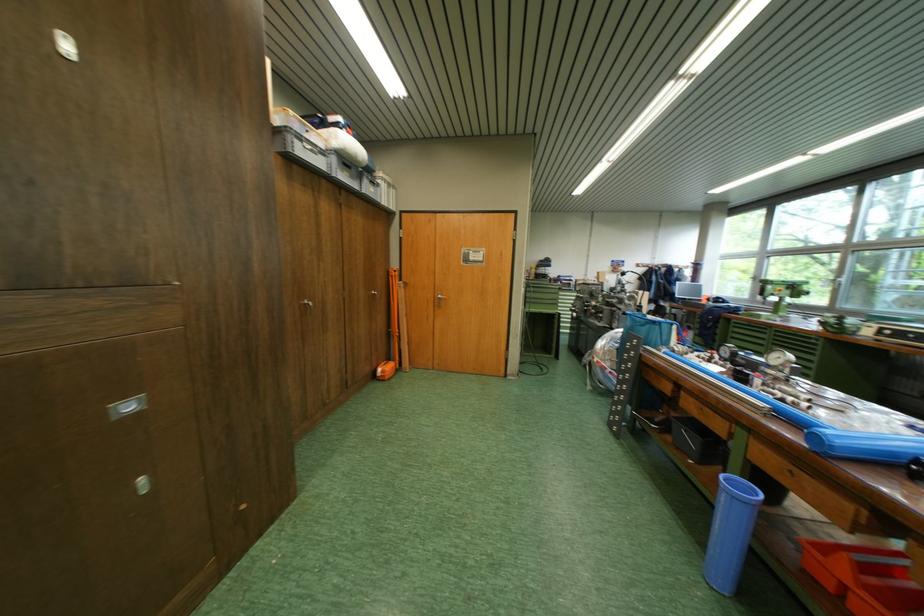
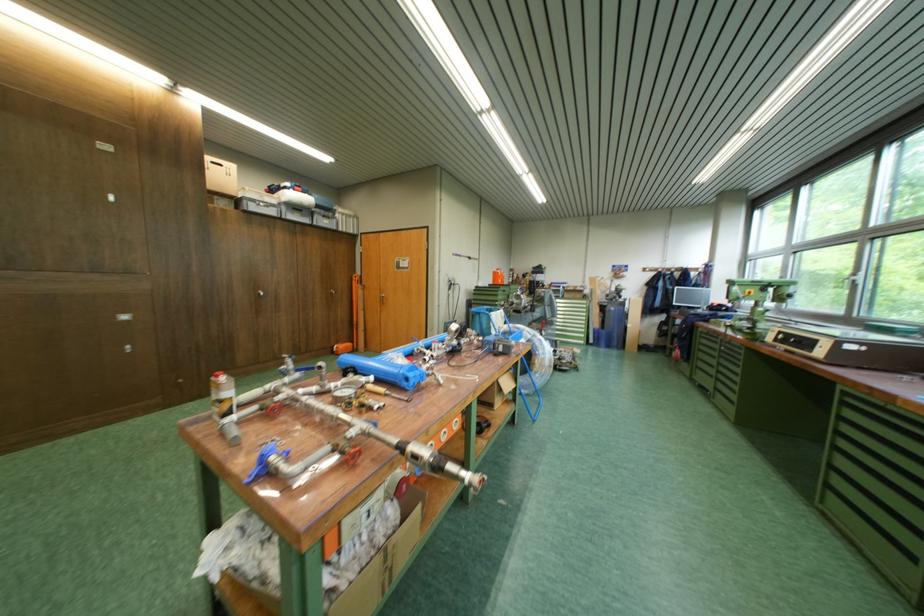
Locate, in the second image, the point that corresponds to point 393,373 in the first image.

(347, 350)